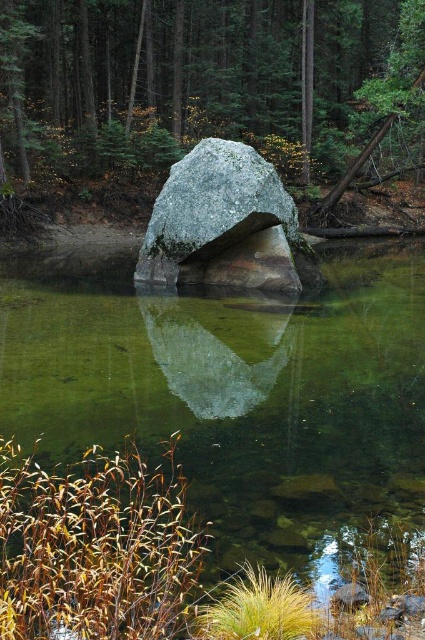
Between point (246, 88) and point (285, 205), which one is positioned behind?

Positioned behind is point (246, 88).

Who is positioned more to the left, smooth gray rock at center or gray granite boulder at center?

From the viewer's perspective, smooth gray rock at center appears more on the left side.

Who is more distant from viewer, (104,45) or (283,208)?

Point (104,45)

I want to click on smooth gray rock at center, so click(206, 90).

Is point (198, 467) more distant than point (192, 168)?

No, it is not.

At what (x,y) coordinates should I click in order to perform the action: click on clear glass water at center. Please return your answer as a coordinate pair (x, y). Looking at the image, I should click on (232, 392).

Is point (396, 378) closer to camera compared to point (54, 12)?

That is True.

Does clear glass water at center have a lesser width compared to smooth gray rock at center?

Yes, clear glass water at center is thinner than smooth gray rock at center.

Where is `clear glass water at center`? clear glass water at center is located at coordinates (232, 392).

The width and height of the screenshot is (425, 640). What are the coordinates of `clear glass water at center` in the screenshot? It's located at (232, 392).